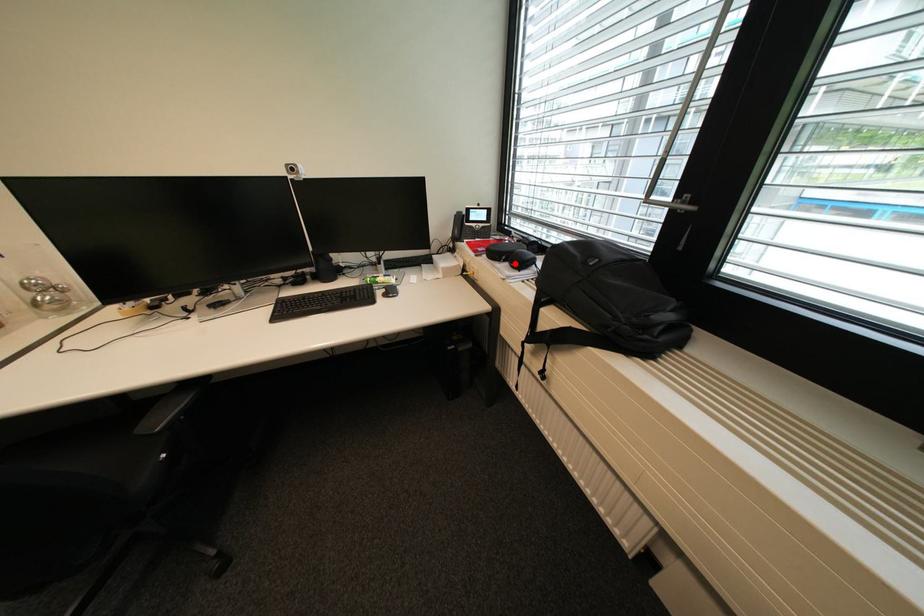
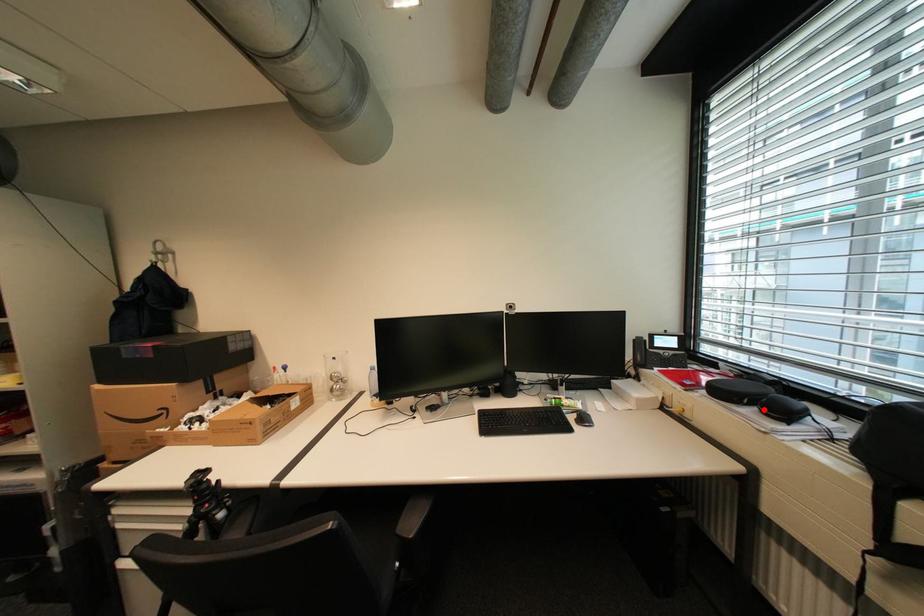
I am providing you with two images of the same scene from different viewpoints. A red point is marked on the first image and another point is marked on the second image. Are the points marked in image1 and image2 representing the same 3D position?

Yes